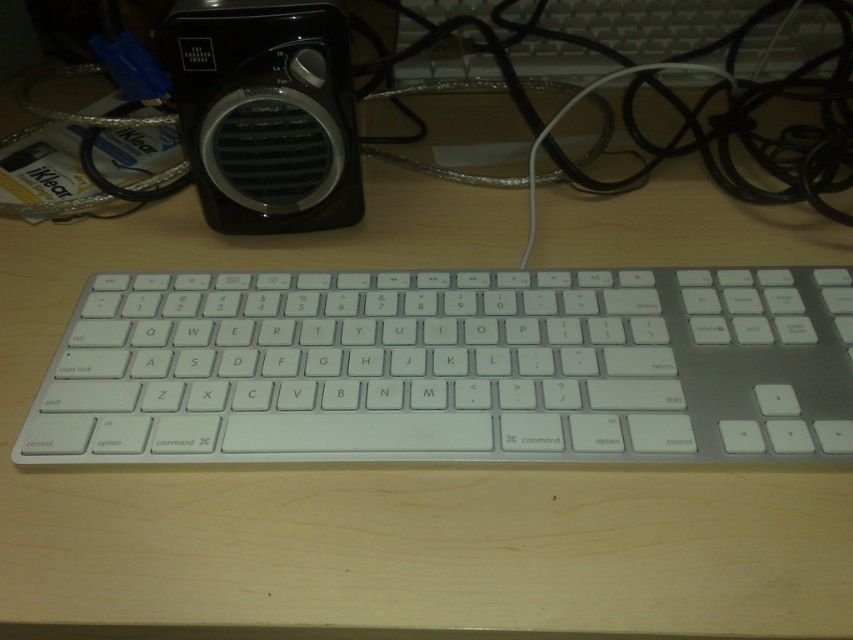
You are setting up a desk and want to know if the sleek silver keyboard at center will fit in the space between the black plastic speaker at upper left and the edge of the desk. Can you determine if there is enough space?

The sleek silver keyboard at center is shorter than the black plastic speaker at upper left, so it is likely that there is enough space for the keyboard between the speaker and the desk edge.

What are the coordinates of the sleek silver keyboard at center?

The sleek silver keyboard at center is located at coordinates point [451,368].

You are a delivery robot positioned at the origin point of the desk. You need to deliver a package to the point closest to point (131, 448) and then to point (206, 152). Which path should you take first?

Since point (131, 448) is in front of point (206, 152), you should first go to point (131, 448) before moving to point (206, 152) to follow the correct spatial order.